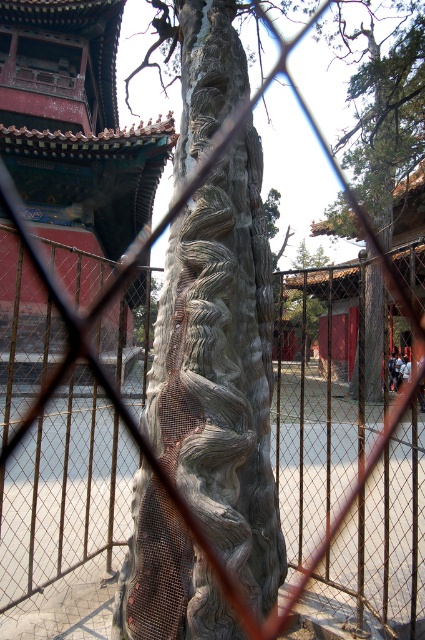
In the scene shown: Which is more to the right, gray textured stone at center or gray textured bark at center?

Positioned to the right is gray textured bark at center.

Is gray textured stone at center taller than gray textured bark at center?

Incorrect, gray textured stone at center's height is not larger of gray textured bark at center's.

This screenshot has height=640, width=425. I want to click on gray textured stone at center, so coord(221,371).

Who is more forward, (x=343, y=412) or (x=142, y=211)?

Positioned in front is point (x=343, y=412).

Can you confirm if metal mesh fence at center is taller than matte red temple at upper left?

No, metal mesh fence at center is not taller than matte red temple at upper left.

Does point (382, 408) come in front of point (81, 12)?

Yes, it is.

The image size is (425, 640). Find the location of `metal mesh fence at center`. metal mesh fence at center is located at coordinates (316, 403).

Consider the image. Can you confirm if matte red temple at upper left is positioned to the right of gray textured bark at center?

In fact, matte red temple at upper left is to the left of gray textured bark at center.

Is matte red temple at upper left thinner than gray textured bark at center?

No, matte red temple at upper left is not thinner than gray textured bark at center.

Does point (45, 76) come in front of point (405, 129)?

No, (45, 76) is further to viewer.

Locate an element on the screen. matte red temple at upper left is located at coordinates (74, 124).